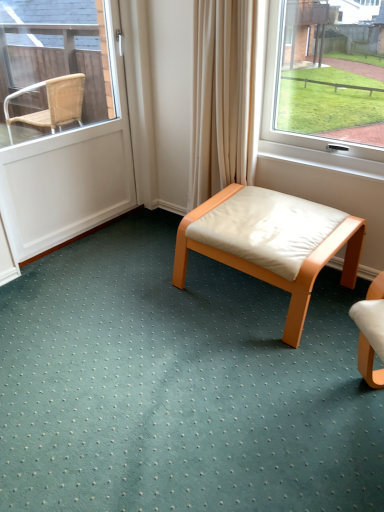
Question: From their relative heights in the image, would you say light brown wood stool at center is taller or shorter than white matte door at left?

Choices:
 (A) short
 (B) tall

Answer: (A)

Question: In terms of size, does light brown wood stool at center appear bigger or smaller than white matte door at left?

Choices:
 (A) big
 (B) small

Answer: (A)

Question: Considering the relative positions of light brown wood stool at center and white matte door at left in the image provided, is light brown wood stool at center to the left or to the right of white matte door at left?

Choices:
 (A) right
 (B) left

Answer: (A)

Question: From a real-world perspective, relative to light brown wood stool at center, is white matte door at left vertically above or below?

Choices:
 (A) above
 (B) below

Answer: (A)

Question: Is white matte door at left spatially inside light brown wood stool at center, or outside of it?

Choices:
 (A) inside
 (B) outside

Answer: (B)

Question: From their relative heights in the image, would you say white matte door at left is taller or shorter than light brown wood stool at center?

Choices:
 (A) tall
 (B) short

Answer: (A)

Question: In the image, is white matte door at left on the left side or the right side of light brown wood stool at center?

Choices:
 (A) left
 (B) right

Answer: (A)